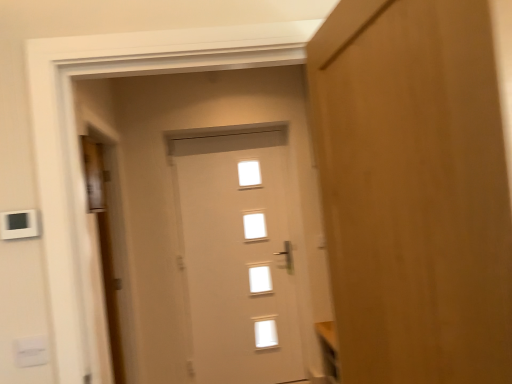
In order to click on wooden door at left, the first door in the left-to-right sequence in this screenshot , I will do `click(104, 245)`.

The image size is (512, 384). I want to click on white glossy door at center, which is the 2th door from right to left, so click(x=238, y=263).

Locate an element on the screen. white plastic light switch at lower left, the first light switch when ordered from bottom to top is located at coordinates (31, 351).

Describe the element at coordinates (19, 224) in the screenshot. I see `white plastic light switch at upper left, positioned as the first light switch in top-to-bottom order` at that location.

I want to click on wooden door at left, the second door when ordered from front to back, so click(104, 245).

Is wooden door at left, marked as the third door in a right-to-left arrangement, inside the boundaries of white plastic light switch at upper left, positioned as the first light switch in top-to-bottom order, or outside?

wooden door at left, marked as the third door in a right-to-left arrangement, exists outside the volume of white plastic light switch at upper left, positioned as the first light switch in top-to-bottom order.

Is wooden door at left, the second door when ordered from front to back, positioned before white plastic light switch at upper left, positioned as the first light switch in top-to-bottom order?

No, wooden door at left, the second door when ordered from front to back, is further to the viewer.

Who is smaller, wooden door at left, the second door when ordered from front to back, or white plastic light switch at upper left, the 2th light switch ordered from the bottom?

white plastic light switch at upper left, the 2th light switch ordered from the bottom, is smaller.

Is wooden door at left, the first door in the left-to-right sequence, beside white plastic light switch at upper left, positioned as the first light switch in top-to-bottom order?

wooden door at left, the first door in the left-to-right sequence, and white plastic light switch at upper left, positioned as the first light switch in top-to-bottom order, are not in contact.

How distant is wooden door at left, positioned as the 2th door in back-to-front order, from white glossy door at center, the 2th door viewed from the left?

wooden door at left, positioned as the 2th door in back-to-front order, is 38.18 inches away from white glossy door at center, the 2th door viewed from the left.

Who is shorter, wooden door at left, the first door in the left-to-right sequence, or white glossy door at center, which is the 2th door from right to left?

Standing shorter between the two is wooden door at left, the first door in the left-to-right sequence.

Between wooden door at left, the first door in the left-to-right sequence, and white glossy door at center, the 2th door viewed from the left, which one has smaller size?

wooden door at left, the first door in the left-to-right sequence, is smaller.

From a real-world perspective, which object rests below the other?

From a 3D spatial view, white glossy door at center, the 2th door viewed from the left, is below.

Which object is thinner, wooden door at right, which is counted as the first door, starting from the front, or white plastic light switch at lower left, the first light switch when ordered from bottom to top?

white plastic light switch at lower left, the first light switch when ordered from bottom to top.

How far apart are wooden door at right, which is counted as the first door, starting from the front, and white plastic light switch at lower left, which ranks as the second light switch in top-to-bottom order?

wooden door at right, which is counted as the first door, starting from the front, and white plastic light switch at lower left, which ranks as the second light switch in top-to-bottom order, are 1.12 meters apart.

Is wooden door at right, which appears as the 3th door when viewed from the left, looking in the opposite direction of white plastic light switch at lower left, the first light switch when ordered from bottom to top?

No.

Which is in front, wooden door at right, which is counted as the first door, starting from the front, or white plastic light switch at lower left, the first light switch when ordered from bottom to top?

wooden door at right, which is counted as the first door, starting from the front, is in front.

Between white plastic light switch at upper left, positioned as the first light switch in top-to-bottom order, and wooden door at left, positioned as the 2th door in back-to-front order, which one has less height?

white plastic light switch at upper left, positioned as the first light switch in top-to-bottom order.

Choose the correct answer: Is white plastic light switch at upper left, positioned as the first light switch in top-to-bottom order, inside wooden door at left, the second door when ordered from front to back, or outside it?

white plastic light switch at upper left, positioned as the first light switch in top-to-bottom order, is not inside wooden door at left, the second door when ordered from front to back, it's outside.

In the image, is white plastic light switch at upper left, the 2th light switch ordered from the bottom, positioned in front of or behind wooden door at left, positioned as the 2th door in back-to-front order?

In the image, white plastic light switch at upper left, the 2th light switch ordered from the bottom, appears in front of wooden door at left, positioned as the 2th door in back-to-front order.

Does point (36, 228) appear closer or farther from the camera than point (98, 175)?

Point (36, 228).

Considering the relative sizes of white plastic light switch at lower left, the first light switch when ordered from bottom to top, and white plastic light switch at upper left, positioned as the first light switch in top-to-bottom order, in the image provided, is white plastic light switch at lower left, the first light switch when ordered from bottom to top, shorter than white plastic light switch at upper left, positioned as the first light switch in top-to-bottom order,?

Indeed, white plastic light switch at lower left, the first light switch when ordered from bottom to top, has a lesser height compared to white plastic light switch at upper left, positioned as the first light switch in top-to-bottom order.

Would you say white plastic light switch at lower left, which ranks as the second light switch in top-to-bottom order, is a long distance from white plastic light switch at upper left, the 2th light switch ordered from the bottom?

No.

Which is behind, point (31, 361) or point (29, 229)?

Positioned behind is point (31, 361).

From the image's perspective, between white plastic light switch at lower left, the first light switch when ordered from bottom to top, and white plastic light switch at upper left, positioned as the first light switch in top-to-bottom order, which one is located above?

white plastic light switch at upper left, positioned as the first light switch in top-to-bottom order, is shown above in the image.

Is there a large distance between wooden door at left, the first door in the left-to-right sequence, and white plastic light switch at lower left, the first light switch when ordered from bottom to top?

Yes.

Who is smaller, wooden door at left, the second door when ordered from front to back, or white plastic light switch at lower left, which ranks as the second light switch in top-to-bottom order?

Smaller between the two is white plastic light switch at lower left, which ranks as the second light switch in top-to-bottom order.

Is wooden door at left, the second door when ordered from front to back, thinner than white plastic light switch at lower left, the first light switch when ordered from bottom to top?

No, wooden door at left, the second door when ordered from front to back, is not thinner than white plastic light switch at lower left, the first light switch when ordered from bottom to top.

The image size is (512, 384). In order to click on door that is the 1st object located behind the white plastic light switch at lower left, the first light switch when ordered from bottom to top in this screenshot , I will do `click(104, 245)`.

From a real-world perspective, is wooden door at right, the 3th door in the back-to-front sequence, on white glossy door at center, marked as the 3th door in a front-to-back arrangement?

Yes.

Between wooden door at right, which appears as the 3th door when viewed from the left, and white glossy door at center, which is the 2th door from right to left, which one has larger width?

With larger width is white glossy door at center, which is the 2th door from right to left.

Considering the relative positions of wooden door at right, which is counted as the first door, starting from the front, and white glossy door at center, which is the 2th door from right to left, in the image provided, is wooden door at right, which is counted as the first door, starting from the front, to the left or to the right of white glossy door at center, which is the 2th door from right to left,?

wooden door at right, which is counted as the first door, starting from the front, is to the right of white glossy door at center, which is the 2th door from right to left.

Does wooden door at right, which is counted as the first door, starting from the front, have a greater height compared to white glossy door at center, which is the 2th door from right to left?

No, wooden door at right, which is counted as the first door, starting from the front, is not taller than white glossy door at center, which is the 2th door from right to left.

I want to click on light switch that is the 2nd object located above the wooden door at left, the first door in the left-to-right sequence (from the image's perspective), so click(x=19, y=224).

The width and height of the screenshot is (512, 384). Find the location of `the 1st door to the right when counting from the wooden door at left, positioned as the 2th door in back-to-front order`. the 1st door to the right when counting from the wooden door at left, positioned as the 2th door in back-to-front order is located at coordinates (238, 263).

Looking at the image, which one is located closer to wooden door at right, the 3th door in the back-to-front sequence, white glossy door at center, which is the 2th door from right to left, or white plastic light switch at upper left, positioned as the first light switch in top-to-bottom order?

white plastic light switch at upper left, positioned as the first light switch in top-to-bottom order, is closer to wooden door at right, the 3th door in the back-to-front sequence.

From the picture: Based on their spatial positions, is white glossy door at center, which is the 2th door from right to left, or wooden door at left, marked as the third door in a right-to-left arrangement, further from wooden door at right, which ranks as the first door in right-to-left order?

white glossy door at center, which is the 2th door from right to left, is positioned further to the anchor wooden door at right, which ranks as the first door in right-to-left order.

Based on their spatial positions, is white plastic light switch at lower left, the first light switch when ordered from bottom to top, or wooden door at left, positioned as the 2th door in back-to-front order, closer to white glossy door at center, the 2th door viewed from the left?

wooden door at left, positioned as the 2th door in back-to-front order, is positioned closer to the anchor white glossy door at center, the 2th door viewed from the left.

Which object lies further to the anchor point white plastic light switch at upper left, positioned as the first light switch in top-to-bottom order, white plastic light switch at lower left, the first light switch when ordered from bottom to top, or wooden door at right, which appears as the 3th door when viewed from the left?

wooden door at right, which appears as the 3th door when viewed from the left, is further to white plastic light switch at upper left, positioned as the first light switch in top-to-bottom order.

Estimate the real-world distances between objects in this image. Which object is further from wooden door at left, marked as the third door in a right-to-left arrangement, white plastic light switch at upper left, positioned as the first light switch in top-to-bottom order, or wooden door at right, which is counted as the first door, starting from the front?

Among the two, wooden door at right, which is counted as the first door, starting from the front, is located further to wooden door at left, marked as the third door in a right-to-left arrangement.

Based on their spatial positions, is wooden door at right, which ranks as the first door in right-to-left order, or wooden door at left, the second door when ordered from front to back, closer to white glossy door at center, which is counted as the 1th door, starting from the back?

The object closer to white glossy door at center, which is counted as the 1th door, starting from the back, is wooden door at left, the second door when ordered from front to back.

Estimate the real-world distances between objects in this image. Which object is further from wooden door at left, the second door when ordered from front to back, white plastic light switch at lower left, the first light switch when ordered from bottom to top, or white glossy door at center, the 2th door viewed from the left?

white plastic light switch at lower left, the first light switch when ordered from bottom to top, is further to wooden door at left, the second door when ordered from front to back.

When comparing their distances from white glossy door at center, which is counted as the 1th door, starting from the back, does white plastic light switch at upper left, positioned as the first light switch in top-to-bottom order, or white plastic light switch at lower left, which ranks as the second light switch in top-to-bottom order, seem closer?

The object closer to white glossy door at center, which is counted as the 1th door, starting from the back, is white plastic light switch at lower left, which ranks as the second light switch in top-to-bottom order.

The width and height of the screenshot is (512, 384). In order to click on light switch located between white plastic light switch at upper left, the 2th light switch ordered from the bottom, and wooden door at right, the 3th door in the back-to-front sequence, in the left-right direction in this screenshot , I will do `click(31, 351)`.

Locate an element on the screen. This screenshot has width=512, height=384. door positioned between white plastic light switch at lower left, which ranks as the second light switch in top-to-bottom order, and white glossy door at center, the 2th door viewed from the left, from near to far is located at coordinates (104, 245).

This screenshot has height=384, width=512. What are the coordinates of `door between white plastic light switch at upper left, positioned as the first light switch in top-to-bottom order, and white glossy door at center, which is the 2th door from right to left, from front to back` in the screenshot? It's located at (104, 245).

Where is `door located between wooden door at right, the 3th door in the back-to-front sequence, and white glossy door at center, marked as the 3th door in a front-to-back arrangement, in the depth direction`? The width and height of the screenshot is (512, 384). door located between wooden door at right, the 3th door in the back-to-front sequence, and white glossy door at center, marked as the 3th door in a front-to-back arrangement, in the depth direction is located at coordinates (104, 245).